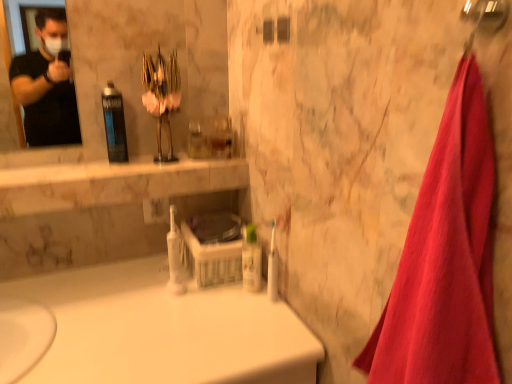
I want to click on space that is in front of clear plastic bottle at center, which is the third mouthwash from top to bottom, so click(252, 334).